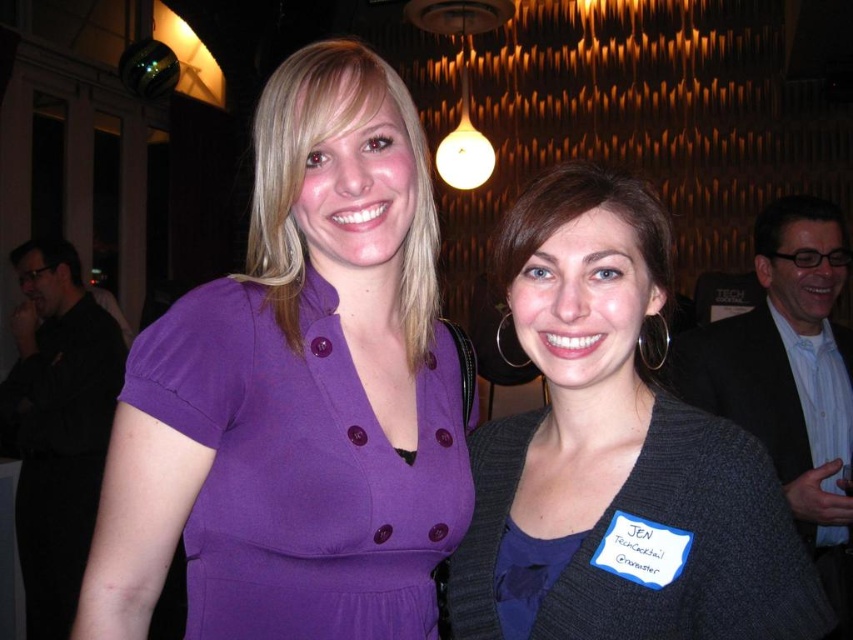
You are a photographer at a social event and need to adjust your camera focus to capture the matte purple dress at center. What coordinates should you set your focus to?

You should set the focus coordinates to point (297,394) to capture the matte purple dress at center.

You are a photographer adjusting your camera settings for a portrait. The focal length of your lens is 50mm, and you want to ensure that the point at coordinate point (375,408) is in focus. Given that the depth of field extends 15 inches in front and behind the focus point, will the entire scene from 20 inches to 50 inches from the camera be within the depth of field?

The point at coordinate point (375,408) is 35.32 inches from the camera. The depth of field extends 15 inches in front and behind this point, meaning it covers from 20.32 inches to 50.32 inches. Since the desired range is 20 to 50 inches, the entire scene will be within the depth of field as the depth of field slightly exceeds the required range.